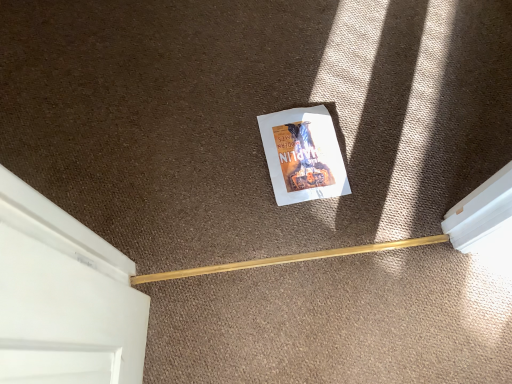
Locate an element on the screen. This screenshot has width=512, height=384. vacant space behind matte paper book at center is located at coordinates (295, 83).